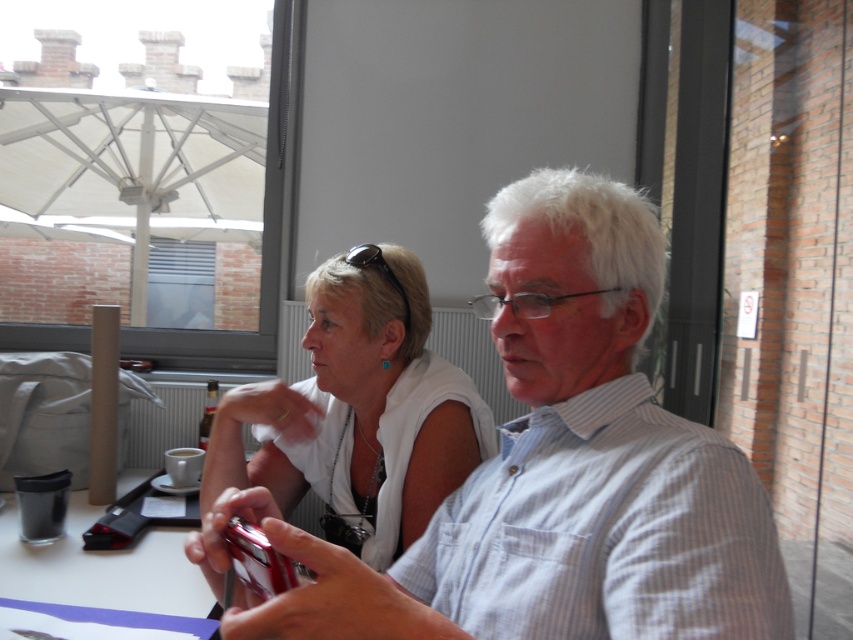
Question: Does white striped shirt at center appear under clear plastic cup at lower left?

Choices:
 (A) no
 (B) yes

Answer: (A)

Question: Which point is closer to the camera?

Choices:
 (A) black plastic sunglasses at upper center
 (B) clear plastic cup at lower left

Answer: (B)

Question: Can you confirm if white striped shirt at center is positioned to the left of black plastic sunglasses at upper center?

Choices:
 (A) no
 (B) yes

Answer: (A)

Question: Which of the following is the farthest from the observer?

Choices:
 (A) white striped shirt at center
 (B) clear plastic cup at lower left
 (C) white fabric shirt at center
 (D) black plastic sunglasses at upper center

Answer: (D)

Question: Can you confirm if clear plastic cup at lower left is thinner than black plastic sunglasses at upper center?

Choices:
 (A) yes
 (B) no

Answer: (B)

Question: Considering the real-world distances, which object is closest to the white striped shirt at center?

Choices:
 (A) black plastic sunglasses at upper center
 (B) white fabric shirt at center

Answer: (B)